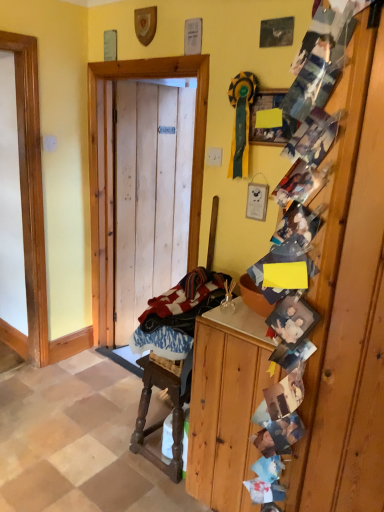
Question: From the image's perspective, is blue and white fabric at lower center located above or below wooden carved rocking chair at center?

Choices:
 (A) below
 (B) above

Answer: (B)

Question: Would you say blue and white fabric at lower center is to the left or to the right of wooden carved rocking chair at center in the picture?

Choices:
 (A) right
 (B) left

Answer: (A)

Question: Which object is positioned closest to the wooden carved rocking chair at center?

Choices:
 (A) blue and white fabric at lower center
 (B) matte yellow paper at upper center
 (C) wooden cabinet at right
 (D) wooden door at center

Answer: (A)

Question: Which object is positioned farthest from the wooden carved rocking chair at center?

Choices:
 (A) matte yellow paper at upper center
 (B) wooden door at center
 (C) blue and white fabric at lower center
 (D) wooden cabinet at right

Answer: (A)